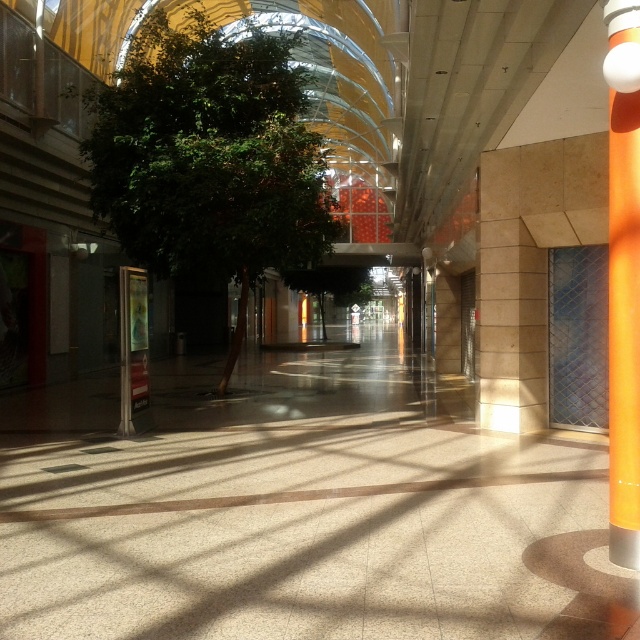
Question: Which object is farther from the camera taking this photo?

Choices:
 (A) orange glossy pole at right
 (B) green leafy tree at center

Answer: (B)

Question: Among these objects, which one is nearest to the camera?

Choices:
 (A) orange glossy pole at right
 (B) green leafy tree at center

Answer: (A)

Question: Is green leafy tree at center above orange glossy pole at right?

Choices:
 (A) no
 (B) yes

Answer: (B)

Question: Can you confirm if green leafy tree at center is smaller than orange glossy pole at right?

Choices:
 (A) no
 (B) yes

Answer: (B)

Question: Is green leafy tree at center thinner than orange glossy pole at right?

Choices:
 (A) no
 (B) yes

Answer: (A)